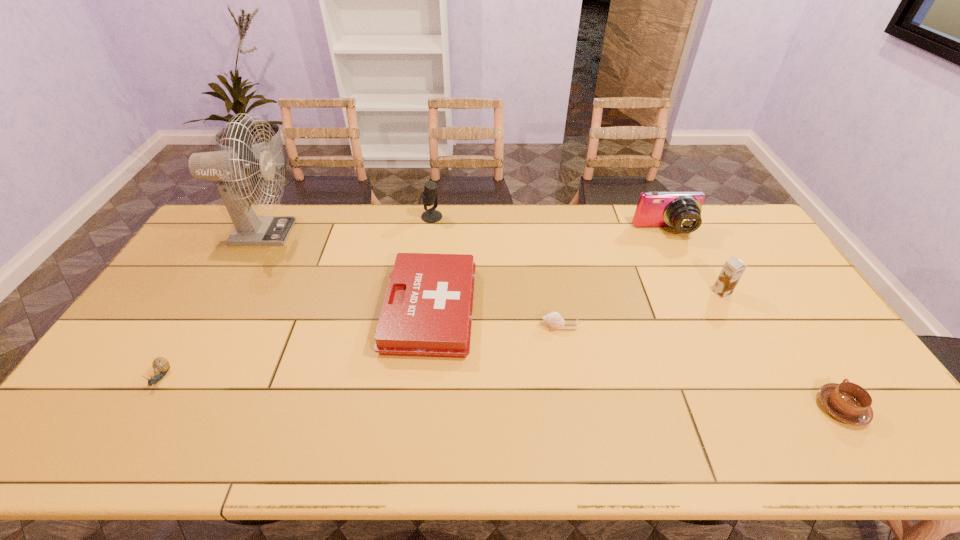
Find the location of a particular element. free space between the microphone and the rightmost object is located at coordinates (636, 312).

This screenshot has height=540, width=960. What are the coordinates of `empty space between the camera and the farther escargot` in the screenshot? It's located at (612, 279).

Identify the location of object that stands as the fourth closest to the fifth tallest object. The image size is (960, 540). (160, 365).

Identify which object is the second closest to the right escargot. Please provide its 2D coordinates. Your answer should be formatted as a tuple, i.e. [(x, y)], where the tuple contains the x and y coordinates of a point satisfying the conditions above.

[(733, 269)]

The width and height of the screenshot is (960, 540). I want to click on vacant space that satisfies the following two spatial constraints: 1. on the air flow direction of the fan; 2. on the front-facing side of the left escargot, so click(x=178, y=377).

This screenshot has width=960, height=540. Identify the location of free point that satisfies the following two spatial constraints: 1. on the front-facing side of the camera; 2. on the right side of the chocolate milk. (695, 293).

This screenshot has width=960, height=540. What are the coordinates of `free space in the image that satisfies the following two spatial constraints: 1. on the air flow direction of the fan; 2. on the front-facing side of the left escargot` in the screenshot? It's located at (178, 377).